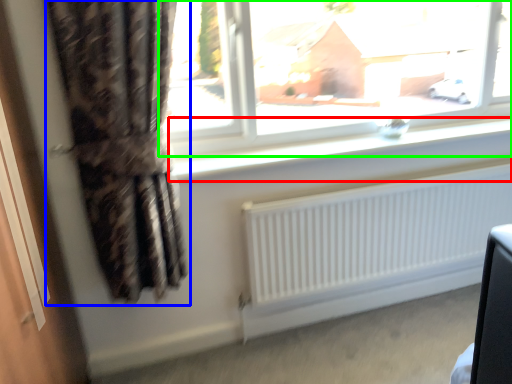
Question: Considering the real-world distances, which object is farthest from window sill (highlighted by a red box)? curtain (highlighted by a blue box) or window (highlighted by a green box)?

Choices:
 (A) curtain
 (B) window

Answer: (B)